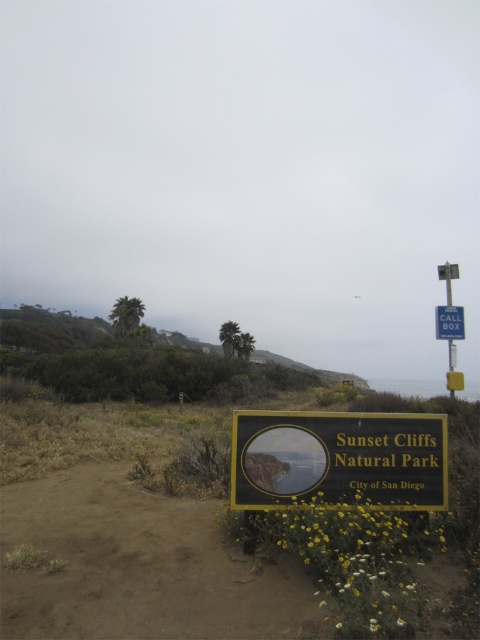
You are standing at the edge of the dirt path leading to the Sunset Cliffs Natural Park sign. You want to place a 3 meter long wooden bench along the path. Is there enough space between you and the brown sandy soil at lower center to fit the bench?

The brown sandy soil at lower center is 3.17 meters away from the viewer. Since the bench is 3 meters long, there is enough space to place it along the path between you and the brown sandy soil at lower center.

You are a hiker who has just arrived at Sunset Cliffs Natural Park. You see the gold metallic sign at center and the blue plastic call box at upper right. Which object is located higher up in the image?

The blue plastic call box at upper right is located higher up in the image than the gold metallic sign at center because the gold metallic sign at center is positioned under the blue plastic call box at upper right.

You are standing at the origin point of the coordinate system in the image. You want to walk to the brown sandy soil at lower center. What are the coordinates you need to move to?

The coordinates for the brown sandy soil at lower center are at point (139, 564).